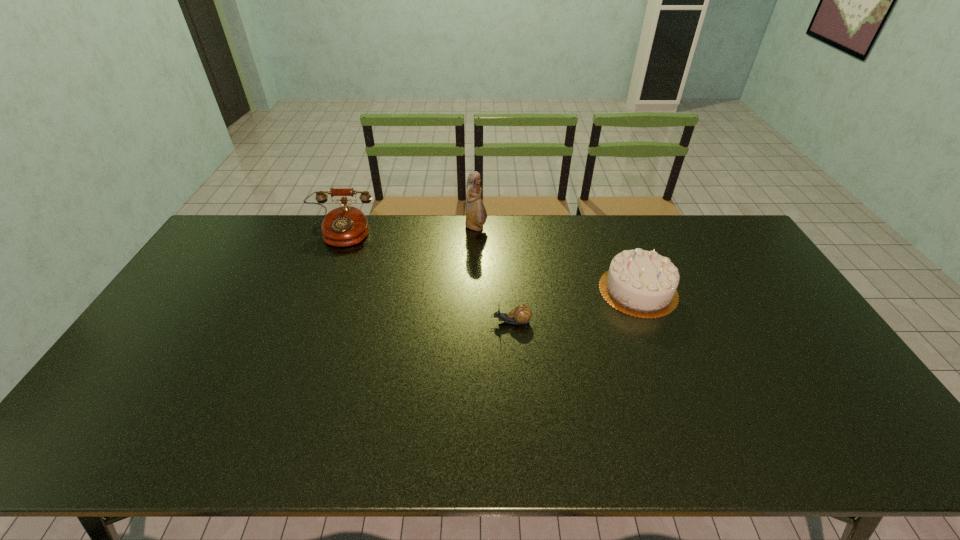
Find the location of a particular element. This screenshot has width=960, height=540. free space that satisfies the following two spatial constraints: 1. on the dial of the telephone; 2. on the left side of the birthday cake is located at coordinates (318, 291).

Where is `free point that satisfies the following two spatial constraints: 1. on the dial of the birthday cake; 2. on the right side of the leftmost object`? The image size is (960, 540). free point that satisfies the following two spatial constraints: 1. on the dial of the birthday cake; 2. on the right side of the leftmost object is located at coordinates (318, 291).

This screenshot has width=960, height=540. What are the coordinates of `free point that satisfies the following two spatial constraints: 1. on the front-facing side of the rightmost object; 2. on the right side of the figurine` in the screenshot? It's located at (475, 291).

Identify the location of vacant region that satisfies the following two spatial constraints: 1. on the front side of the rightmost object; 2. on the front-facing side of the shortest object. [x=650, y=322].

At what (x,y) coordinates should I click in order to perform the action: click on free spot that satisfies the following two spatial constraints: 1. on the front-facing side of the figurine; 2. on the back side of the birthday cake. Please return your answer as a coordinate pair (x, y). Image resolution: width=960 pixels, height=540 pixels. Looking at the image, I should click on (475, 291).

At what (x,y) coordinates should I click in order to perform the action: click on vacant region that satisfies the following two spatial constraints: 1. on the front-facing side of the rightmost object; 2. on the right side of the tallest object. Please return your answer as a coordinate pair (x, y). The height and width of the screenshot is (540, 960). Looking at the image, I should click on (475, 291).